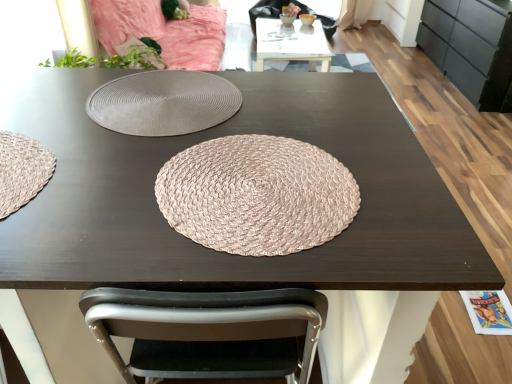
I want to click on vacant area that lies in front of matte gray placemat at center, so click(101, 182).